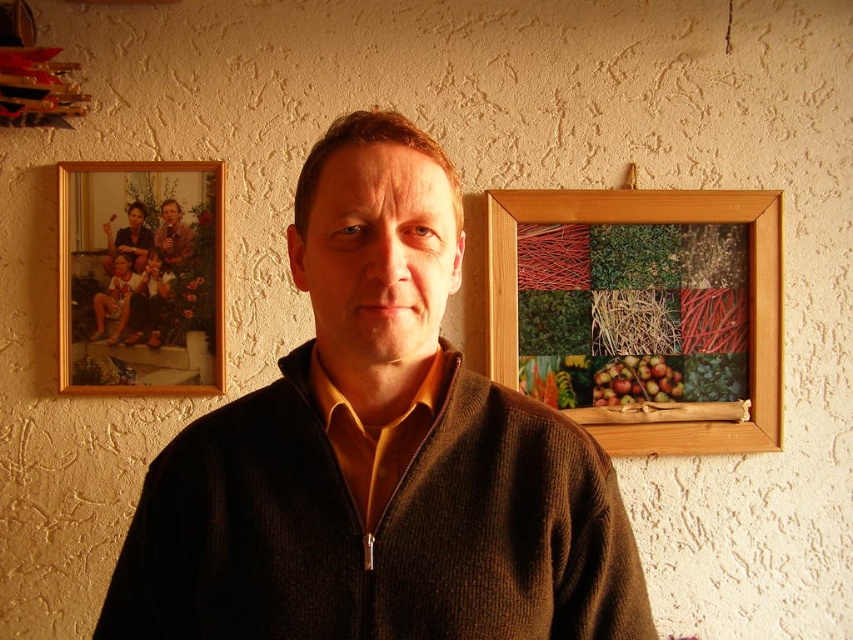
You are a tailor who needs to measure the distance between the brown knitted sweater at center and the wall behind the man. The wall is 3 feet away from the viewer. Can you determine if the sweater is closer to the viewer than the wall?

The brown knitted sweater at center is 21.65 inches from viewer, and the wall is 3 feet away. Since 3 feet equals 36 inches, the sweater is closer to the viewer than the wall.

You are an interior designer assessing the placement of the brown knitted sweater at center in the image. The sweater is positioned at coordinates point (378, 454). If the wall is divided into a grid with horizontal and vertical lines spaced every 0.1 units, which grid cell does the brown knitted sweater at center fall into?

The brown knitted sweater at center is located at point (378, 454). When dividing the wall into a grid spaced every 0.1 units, the coordinates fall into the cell at row 5 and column 8. This is calculated by multiplying the y and x coordinates by 10, resulting in row 5 and column 8 respectively.